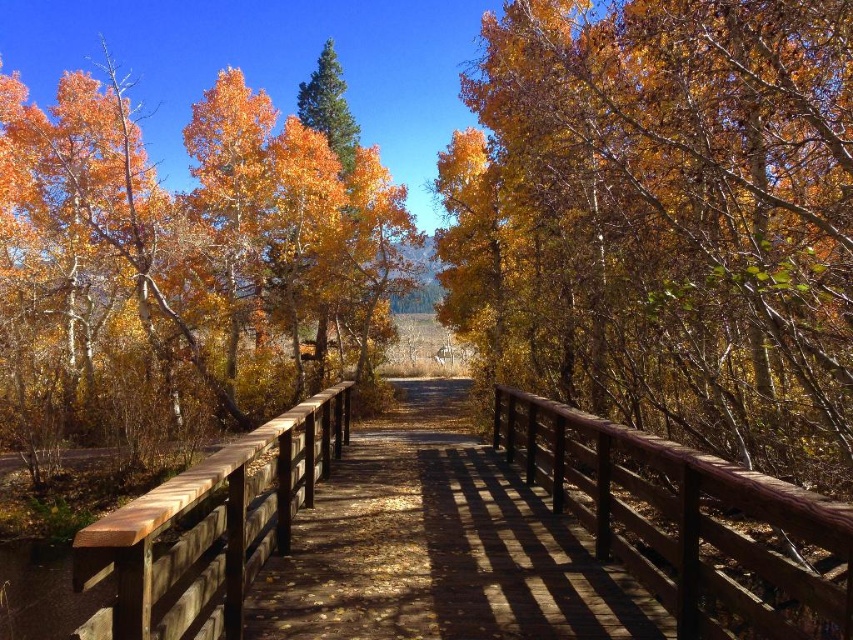
Between point (80, 401) and point (822, 614), which one is positioned in front?

Point (822, 614) is more forward.

Which is more to the right, orange leaves at left or wooden bridge at center?

Positioned to the right is wooden bridge at center.

Identify the location of orange leaves at left. 184,268.

At what (x,y) coordinates should I click in order to perform the action: click on orange leaves at left. Please return your answer as a coordinate pair (x, y). The width and height of the screenshot is (853, 640). Looking at the image, I should click on (184, 268).

Is golden-brown bark tree at center shorter than wooden bridge at center?

In fact, golden-brown bark tree at center may be taller than wooden bridge at center.

This screenshot has height=640, width=853. What do you see at coordinates (665, 220) in the screenshot?
I see `golden-brown bark tree at center` at bounding box center [665, 220].

Identify the location of golden-brown bark tree at center. (665, 220).

In the scene shown: Between orange leaves at left and brown wooden rail at center, which one has less height?

brown wooden rail at center is shorter.

How far apart are orange leaves at left and brown wooden rail at center?

orange leaves at left and brown wooden rail at center are 21.84 meters apart.

I want to click on orange leaves at left, so click(x=184, y=268).

At what (x,y) coordinates should I click in order to perform the action: click on orange leaves at left. Please return your answer as a coordinate pair (x, y). Looking at the image, I should click on (184, 268).